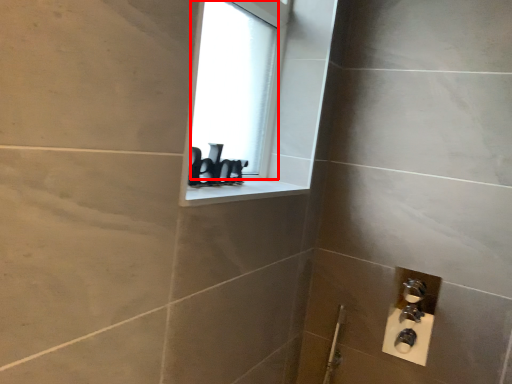
Question: Where is window screen (annotated by the red box) located in relation to window sill in the image?

Choices:
 (A) left
 (B) right

Answer: (A)